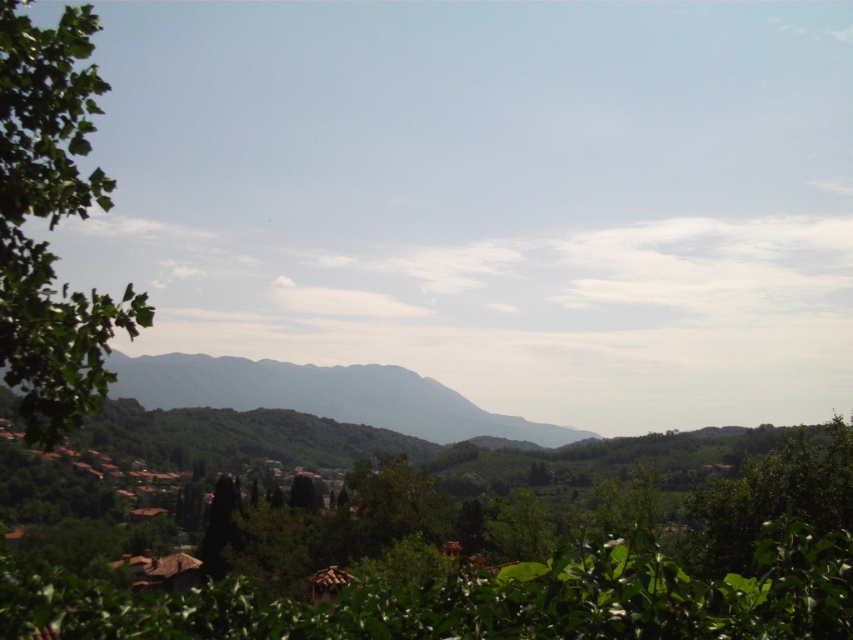
In the scene shown: You are standing at the center of the village looking towards the distant mountains. You notice a green leafy tree at center. Based on its position, can you determine if the tree is closer to you or further away compared to the village rooftops?

The green leafy tree at center is located at point (486, 598), which places it closer to the viewer than the village rooftops, so the tree is closer to you.

You are standing in the middle of the scene and want to take a photo of both the green leafy tree at left and the green textured mountain at center. Which object should you adjust your camera to focus on first to ensure both are in the frame?

The green leafy tree at left is positioned on the right side of green textured mountain at center, so you should focus on the green textured mountain at center first to ensure both are in the frame.